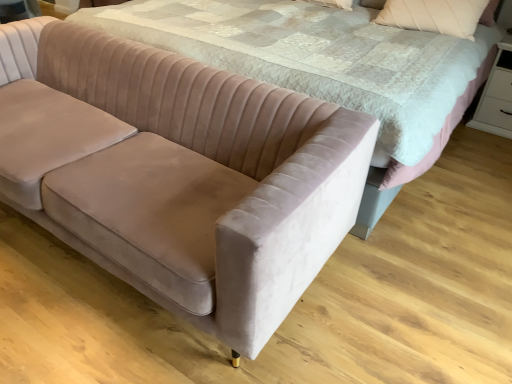
Question: Could you tell me if white glossy dresser at lower right is turned towards velvet pink bed at center?

Choices:
 (A) yes
 (B) no

Answer: (B)

Question: From a real-world perspective, is white glossy dresser at lower right located beneath velvet pink bed at center?

Choices:
 (A) yes
 (B) no

Answer: (A)

Question: Considering the relative positions of white glossy dresser at lower right and velvet pink bed at center in the image provided, is white glossy dresser at lower right to the left of velvet pink bed at center from the viewer's perspective?

Choices:
 (A) yes
 (B) no

Answer: (B)

Question: Would you say white glossy dresser at lower right contains velvet pink bed at center?

Choices:
 (A) no
 (B) yes

Answer: (A)

Question: Does white glossy dresser at lower right have a lesser height compared to velvet pink bed at center?

Choices:
 (A) yes
 (B) no

Answer: (A)

Question: In terms of size, does white glossy dresser at lower right appear bigger or smaller than velvet pink bed at center?

Choices:
 (A) big
 (B) small

Answer: (B)

Question: Is white glossy dresser at lower right wider or thinner than velvet pink bed at center?

Choices:
 (A) wide
 (B) thin

Answer: (B)

Question: In terms of height, does white glossy dresser at lower right look taller or shorter compared to velvet pink bed at center?

Choices:
 (A) short
 (B) tall

Answer: (A)

Question: Considering the positions of point (499, 134) and point (342, 67), is point (499, 134) closer or farther from the camera than point (342, 67)?

Choices:
 (A) farther
 (B) closer

Answer: (A)

Question: Considering the relative positions of white glossy dresser at lower right and velvet beige couch at lower left in the image provided, is white glossy dresser at lower right to the left or to the right of velvet beige couch at lower left?

Choices:
 (A) left
 (B) right

Answer: (B)

Question: Is white glossy dresser at lower right in front of or behind velvet beige couch at lower left in the image?

Choices:
 (A) behind
 (B) front

Answer: (A)

Question: Do you think white glossy dresser at lower right is within velvet beige couch at lower left, or outside of it?

Choices:
 (A) outside
 (B) inside

Answer: (A)

Question: From a real-world perspective, is white glossy dresser at lower right above or below velvet beige couch at lower left?

Choices:
 (A) below
 (B) above

Answer: (A)

Question: Is velvet beige pillow at upper right wider or thinner than velvet beige couch at lower left?

Choices:
 (A) thin
 (B) wide

Answer: (A)

Question: Is velvet beige pillow at upper right in front of or behind velvet beige couch at lower left in the image?

Choices:
 (A) behind
 (B) front

Answer: (A)